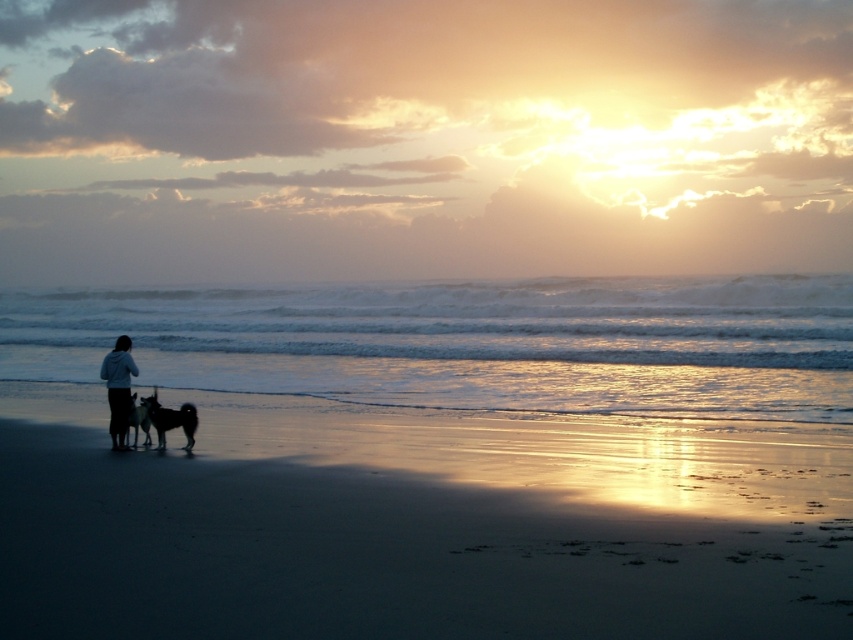
Between silvery fur dog at lower left and shiny black dog at lower left, which one appears on the left side from the viewer's perspective?

From the viewer's perspective, shiny black dog at lower left appears more on the left side.

Does point (180, 422) lie behind point (126, 429)?

That is False.

Identify the location of silvery fur dog at lower left. pos(170,419).

Looking at this image, is sandy beach at lower left closer to the viewer compared to silvery fur dog at lower left?

Yes, sandy beach at lower left is in front of silvery fur dog at lower left.

Between point (102, 404) and point (160, 438), which one is positioned behind?

Positioned behind is point (102, 404).

This screenshot has width=853, height=640. What are the coordinates of `sandy beach at lower left` in the screenshot? It's located at (412, 525).

Can you confirm if sandy beach at lower left is positioned to the right of shiny black dog at lower left?

Yes, sandy beach at lower left is to the right of shiny black dog at lower left.

Who is more forward, (x=688, y=477) or (x=148, y=435)?

Point (x=688, y=477) is in front.

The width and height of the screenshot is (853, 640). Find the location of `sandy beach at lower left`. sandy beach at lower left is located at coordinates (412, 525).